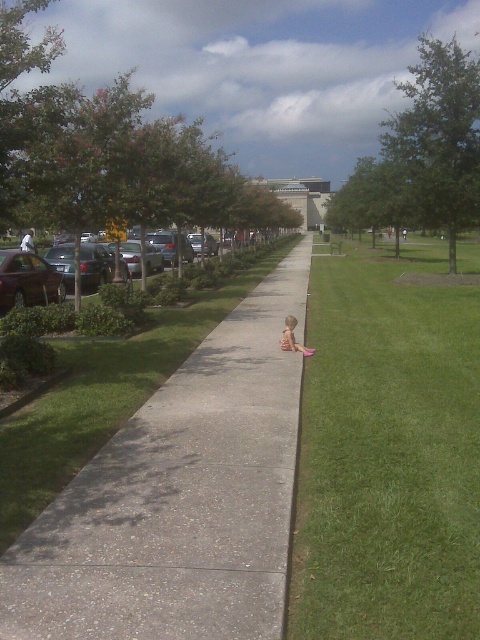
Question: Which of the following is the farthest from the observer?

Choices:
 (A) concrete at center
 (B) gray concrete sidewalk at center
 (C) green grass at center
 (D) light brown wooden chair at center

Answer: (D)

Question: Which object appears closest to the camera in this image?

Choices:
 (A) gray concrete sidewalk at center
 (B) concrete at center
 (C) light brown wooden chair at center
 (D) green grass at center

Answer: (A)

Question: Does green grass at center appear over concrete at center?

Choices:
 (A) yes
 (B) no

Answer: (B)

Question: Can you confirm if green grass at center is positioned below light brown wooden chair at center?

Choices:
 (A) yes
 (B) no

Answer: (B)

Question: Which point is farther to the camera?

Choices:
 (A) click(x=231, y=452)
 (B) click(x=412, y=448)
 (C) click(x=286, y=586)
 (D) click(x=279, y=342)

Answer: (D)

Question: From the image, what is the correct spatial relationship of concrete at center in relation to light brown wooden chair at center?

Choices:
 (A) right
 (B) left

Answer: (A)